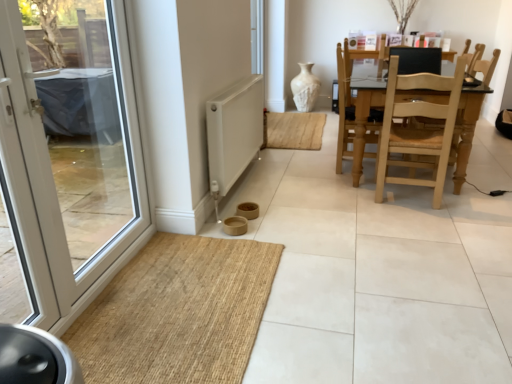
Where is `free space to the right of light wood/wooden chair at right`? free space to the right of light wood/wooden chair at right is located at coordinates (477, 200).